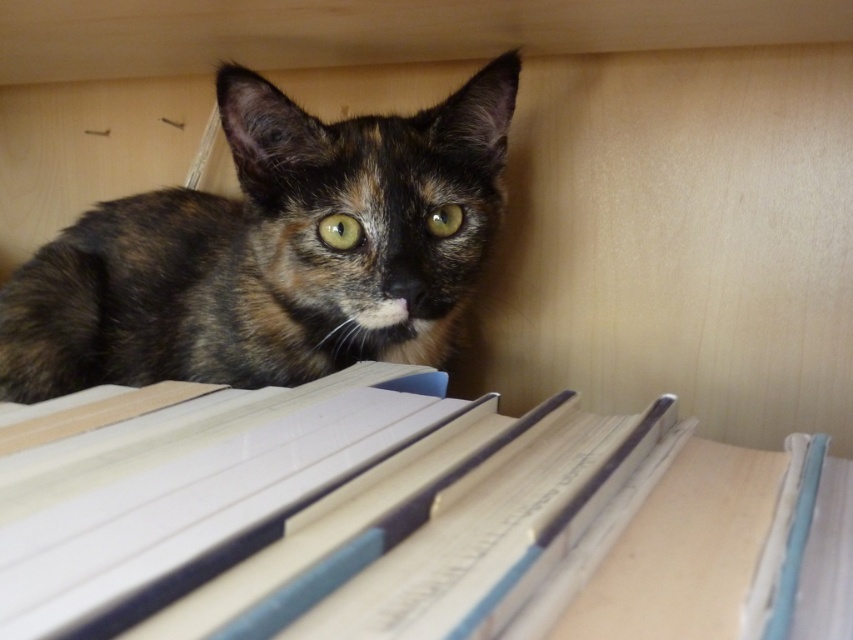
Question: Does hardcover book at center appear on the left side of tortoiseshell fur cat at upper center?

Choices:
 (A) no
 (B) yes

Answer: (A)

Question: Which point is closer to the camera?

Choices:
 (A) (86, 481)
 (B) (114, 298)

Answer: (A)

Question: Which point appears closest to the camera in this image?

Choices:
 (A) 769,496
 (B) 331,285

Answer: (A)

Question: Is hardcover book at center in front of tortoiseshell fur cat at upper center?

Choices:
 (A) yes
 (B) no

Answer: (A)

Question: Is hardcover book at center wider than tortoiseshell fur cat at upper center?

Choices:
 (A) no
 (B) yes

Answer: (A)